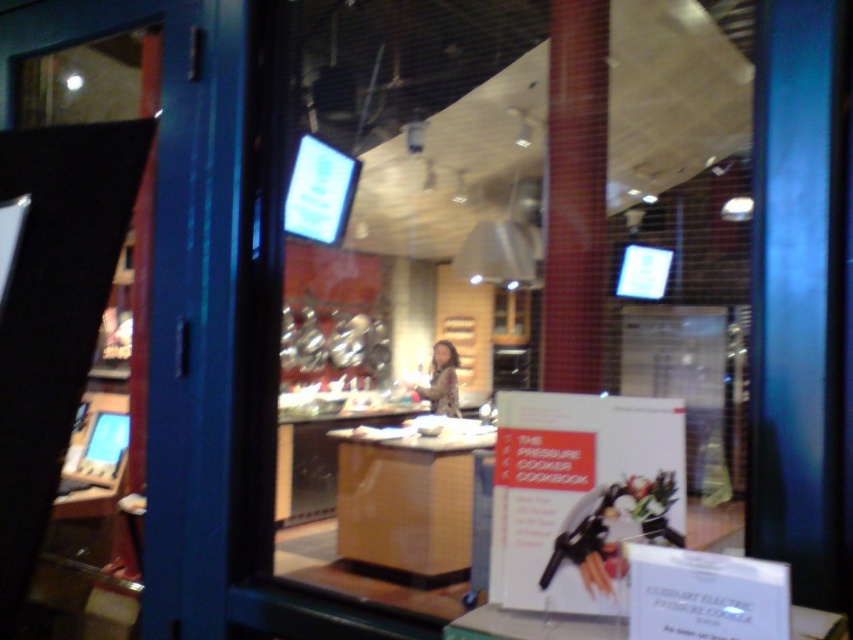
You are a customer standing outside the store and want to read the sign on the white cardboard at center. Can you see it clearly through the transparent glass door at left?

Yes, the white cardboard at center is in front of the transparent glass door at left, so it should be visible through the glass.